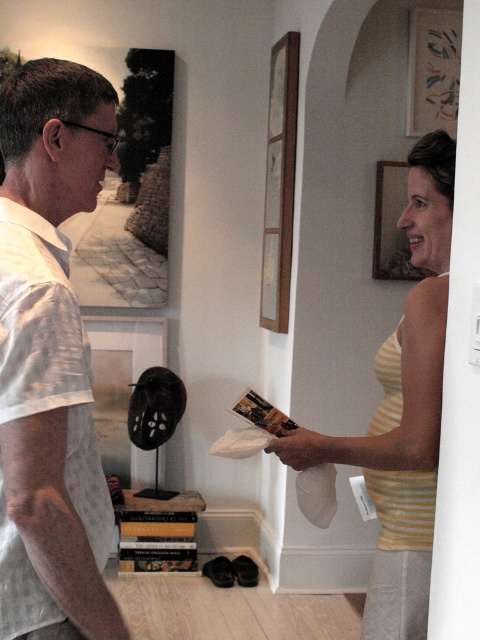
Question: Among these objects, which one is nearest to the camera?

Choices:
 (A) wooden picture frame at upper center
 (B) matte wood picture frame at upper right
 (C) black matte picture frame at left

Answer: (A)

Question: Which object is farther from the camera taking this photo?

Choices:
 (A) white cotton shirt at left
 (B) matte wooden picture frame at upper right

Answer: (B)

Question: Can you confirm if black matte picture frame at left is positioned to the left of wooden picture frame at upper center?

Choices:
 (A) no
 (B) yes

Answer: (B)

Question: Is matte wood picture frame at upper right to the left of matte wooden picture frame at upper right from the viewer's perspective?

Choices:
 (A) yes
 (B) no

Answer: (B)

Question: Is black matte picture frame at left smaller than matte wooden picture frame at upper right?

Choices:
 (A) yes
 (B) no

Answer: (B)

Question: Which point appears farthest from the camera in this image?

Choices:
 (A) (275, 198)
 (B) (44, 394)
 (C) (374, 246)

Answer: (A)